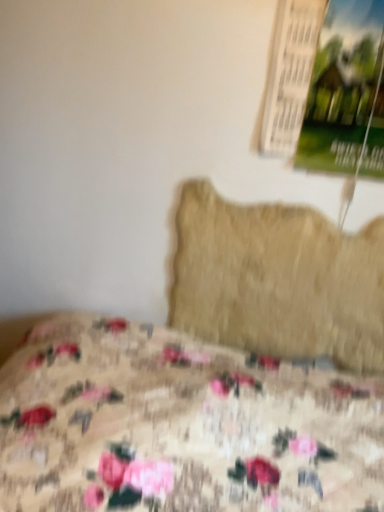
Question: From a real-world perspective, is beige fuzzy pillow at center positioned above or below green paper poster at upper right?

Choices:
 (A) above
 (B) below

Answer: (B)

Question: Based on their positions, is beige fuzzy pillow at center located to the left or right of green paper poster at upper right?

Choices:
 (A) right
 (B) left

Answer: (B)

Question: Which object is positioned farthest from the floral fabric bed at lower left?

Choices:
 (A) beige fuzzy pillow at center
 (B) green paper poster at upper right

Answer: (B)

Question: Which object is positioned farthest from the green paper poster at upper right?

Choices:
 (A) floral fabric bed at lower left
 (B) beige fuzzy pillow at center

Answer: (A)